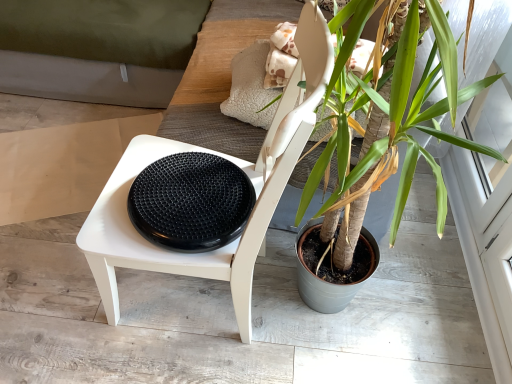
Identify the location of free space to the left of white matte chair at center. (58, 286).